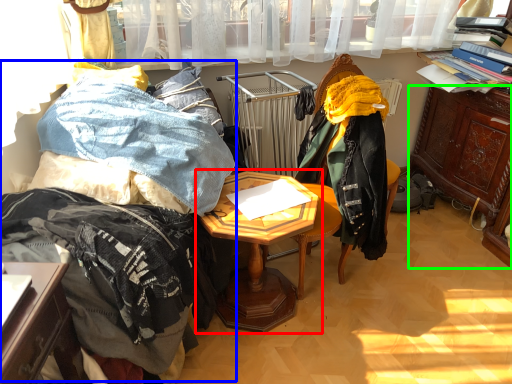
Question: Which object is positioned closest to table (highlighted by a red box)? Select from bed (highlighted by a blue box) and cabinetry (highlighted by a green box).

Choices:
 (A) bed
 (B) cabinetry

Answer: (A)